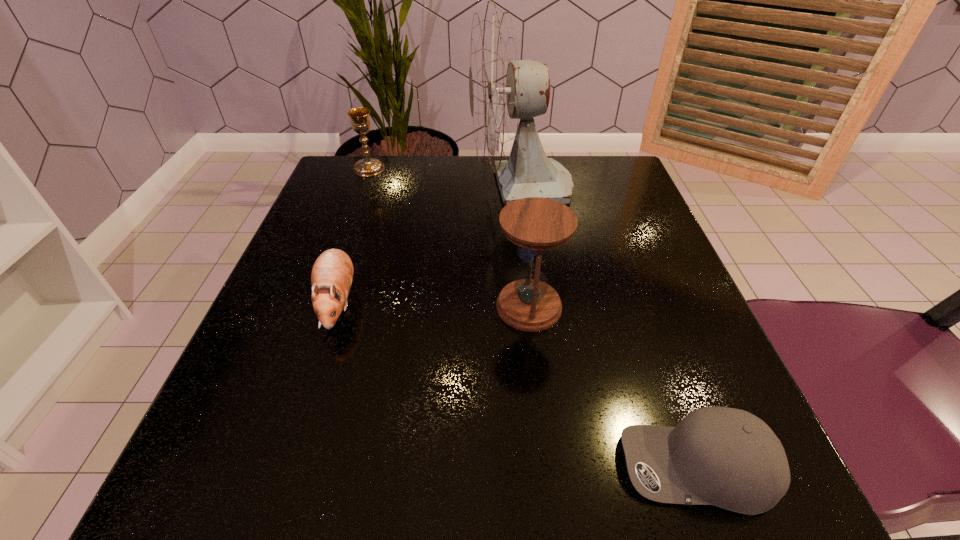
In the image, there is a desktop. Identify the location of vacant space at the far right corner. This screenshot has width=960, height=540. (565, 157).

Identify the location of vacant area that lies between the third tallest object and the hourglass. (449, 238).

Locate an element on the screen. This screenshot has height=540, width=960. vacant space that is in between the hamster and the fourth shortest object is located at coordinates (433, 305).

At what (x,y) coordinates should I click in order to perform the action: click on free space between the hamster and the fan. Please return your answer as a coordinate pair (x, y). This screenshot has width=960, height=540. Looking at the image, I should click on (429, 245).

Identify the location of vacant area that lies between the tallest object and the hamster. (429, 245).

This screenshot has height=540, width=960. In order to click on free space between the second tallest object and the hamster in this screenshot , I will do (433, 305).

The width and height of the screenshot is (960, 540). Identify the location of vacant space that is in between the hamster and the nearest object. (517, 385).

What are the coordinates of `blank region between the third tallest object and the hamster` in the screenshot? It's located at (353, 235).

What are the coordinates of `vacant space that's between the fourth shortest object and the chalice` in the screenshot? It's located at (449, 238).

Locate an element on the screen. This screenshot has width=960, height=540. object that ranks as the third closest to the nearest object is located at coordinates (502, 89).